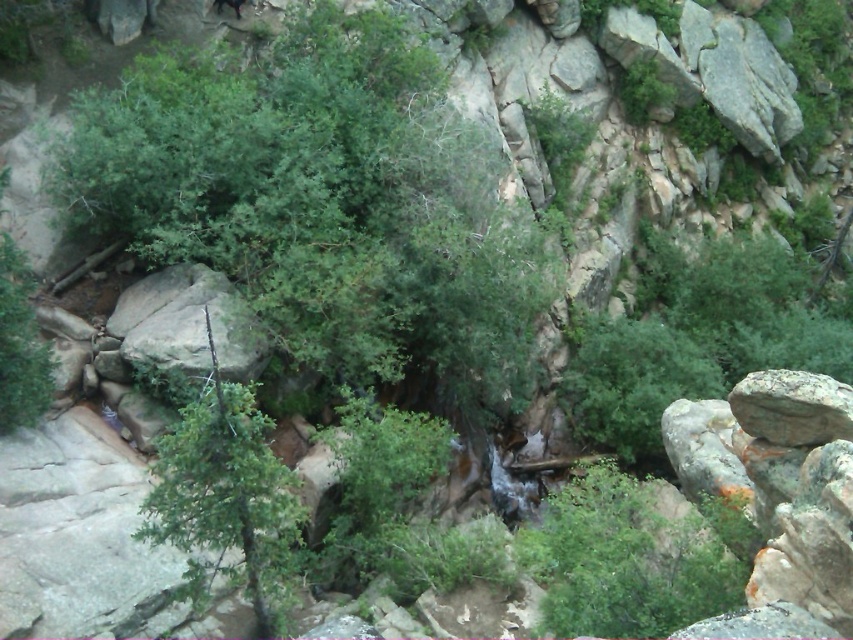
Between green leafy shrub at center and green textured tree at center, which one is positioned higher?

green leafy shrub at center is above.

What do you see at coordinates (695, 337) in the screenshot? I see `green leafy shrub at center` at bounding box center [695, 337].

The width and height of the screenshot is (853, 640). Find the location of `green leafy shrub at center`. green leafy shrub at center is located at coordinates (695, 337).

Image resolution: width=853 pixels, height=640 pixels. Find the location of `green leafy shrub at center`. green leafy shrub at center is located at coordinates (695, 337).

This screenshot has width=853, height=640. What are the coordinates of `green leafy shrub at center` in the screenshot? It's located at (695, 337).

Which of these two, green leafy tree at center or green leafy shrub at center, stands taller?

With more height is green leafy tree at center.

Between point (432, 269) and point (720, 332), which one is positioned in front?

Point (432, 269)

Between point (325, 179) and point (709, 323), which one is positioned behind?

Point (709, 323)

This screenshot has width=853, height=640. Find the location of `green leafy tree at center`. green leafy tree at center is located at coordinates (323, 202).